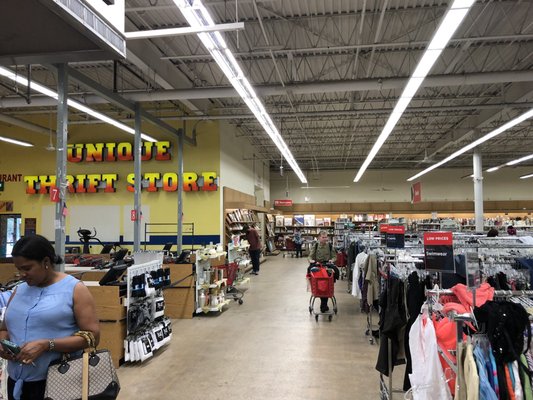
Find the location of a particular element. This screenshot has width=533, height=400. yellow wall is located at coordinates (195, 203).